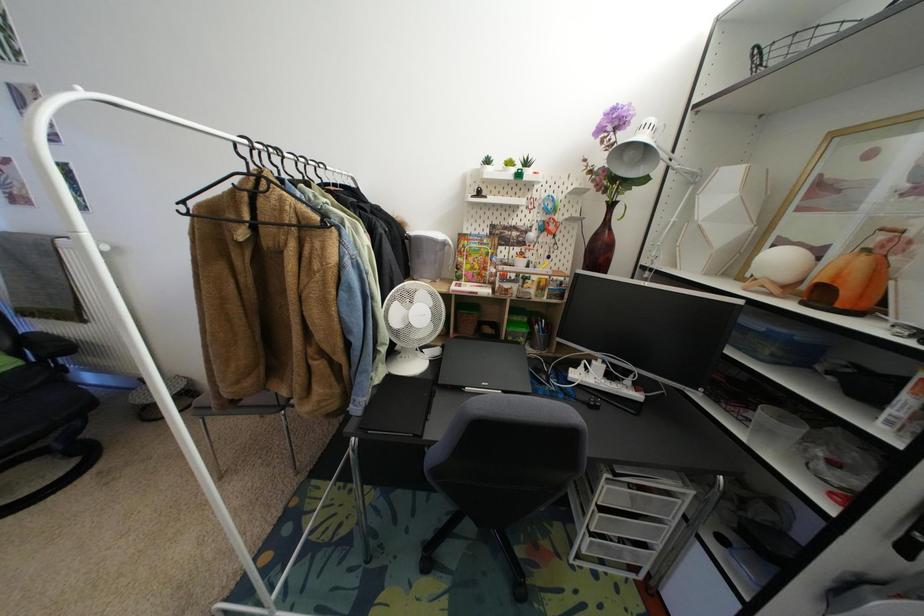
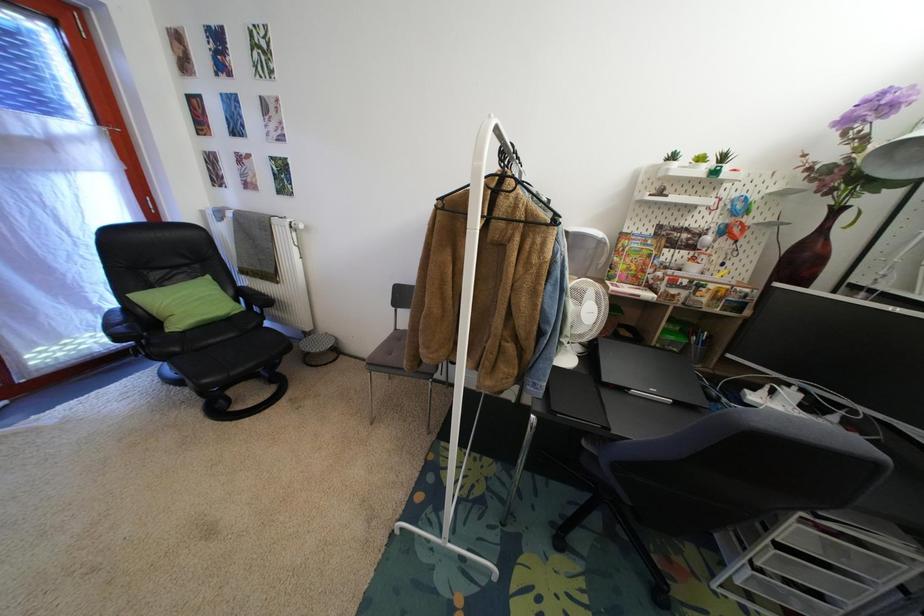
Question: What movement of the cameraman would produce the second image?

Choices:
 (A) Left
 (B) Right
 (C) Forward
 (D) Backward

Answer: (A)